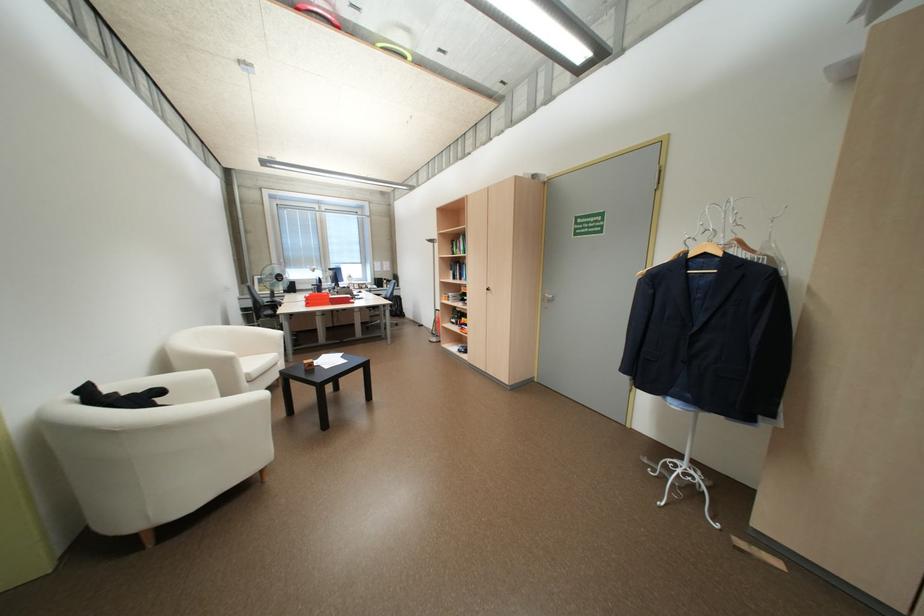
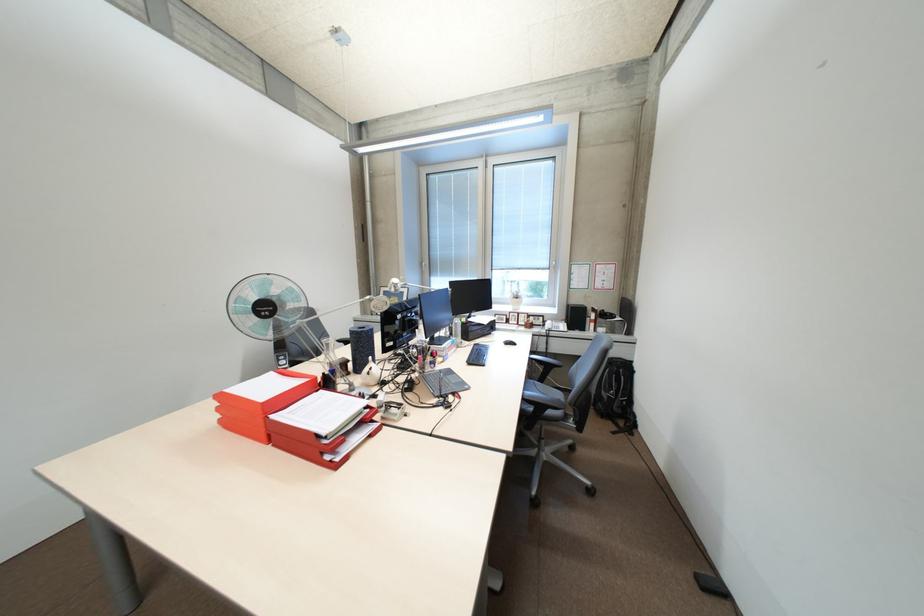
The point at (x=317, y=305) is marked in the first image. Where is the corresponding point in the second image?

(231, 421)